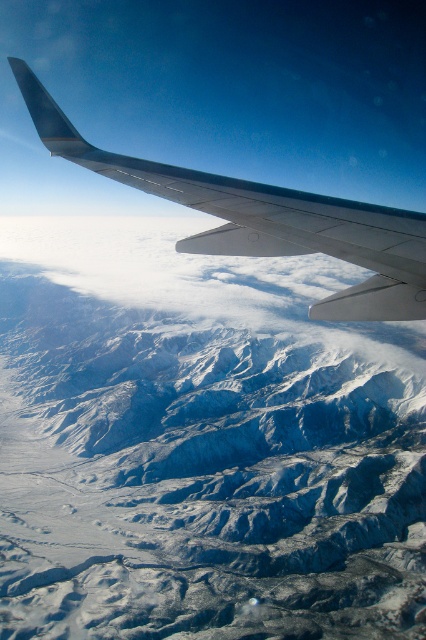
Question: Which point is closer to the camera?

Choices:
 (A) (14, 68)
 (B) (255, 538)

Answer: (A)

Question: Can you confirm if snowy rocky mountain range at upper center is positioned above metallic gray wing at upper center?

Choices:
 (A) no
 (B) yes

Answer: (A)

Question: Can you confirm if snowy rocky mountain range at upper center is positioned to the left of metallic gray wing at upper center?

Choices:
 (A) no
 (B) yes

Answer: (B)

Question: Can you confirm if snowy rocky mountain range at upper center is positioned below metallic gray wing at upper center?

Choices:
 (A) yes
 (B) no

Answer: (A)

Question: Among these points, which one is nearest to the camera?

Choices:
 (A) (244, 589)
 (B) (296, 248)

Answer: (B)